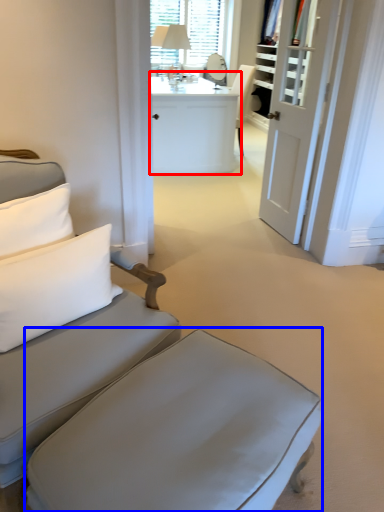
Question: Among these objects, which one is nearest to the camera, desk (highlighted by a red box) or table (highlighted by a blue box)?

Choices:
 (A) desk
 (B) table

Answer: (B)